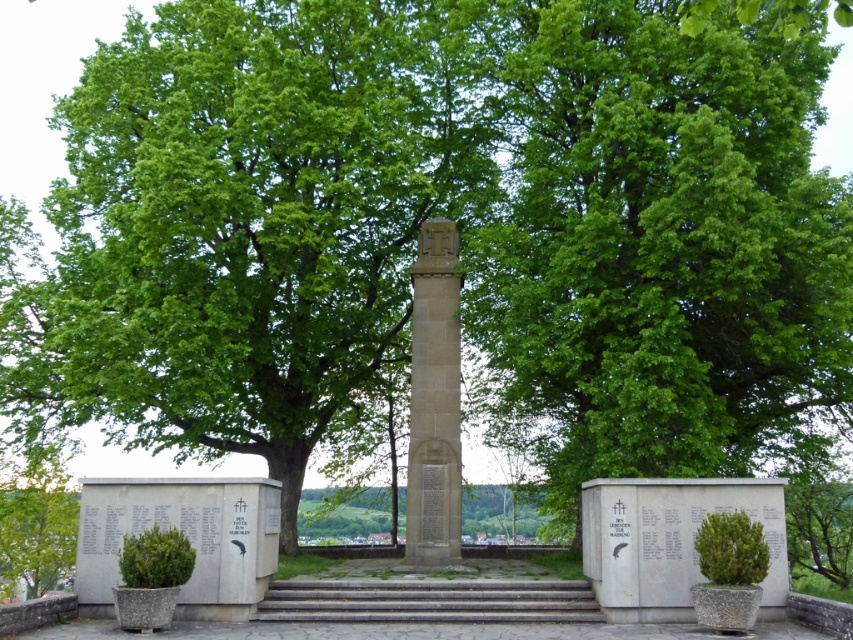
Who is positioned more to the right, green leafy tree at center or stone obelisk at center?

green leafy tree at center

The image size is (853, 640). Describe the element at coordinates (659, 241) in the screenshot. I see `green leafy tree at center` at that location.

Find the location of a particular element. green leafy tree at center is located at coordinates (659, 241).

I want to click on green leafy tree at center, so click(659, 241).

Does green leafy tree at center have a larger size compared to green leafy tree at lower left?

Yes, green leafy tree at center is bigger than green leafy tree at lower left.

Locate an element on the screen. green leafy tree at center is located at coordinates (659, 241).

Is stone obelisk at center below green leafy tree at lower left?

Actually, stone obelisk at center is above green leafy tree at lower left.

Is point (427, 397) positioned behind point (3, 490)?

No, (427, 397) is closer to viewer.

Locate an element on the screen. stone obelisk at center is located at coordinates (434, 401).